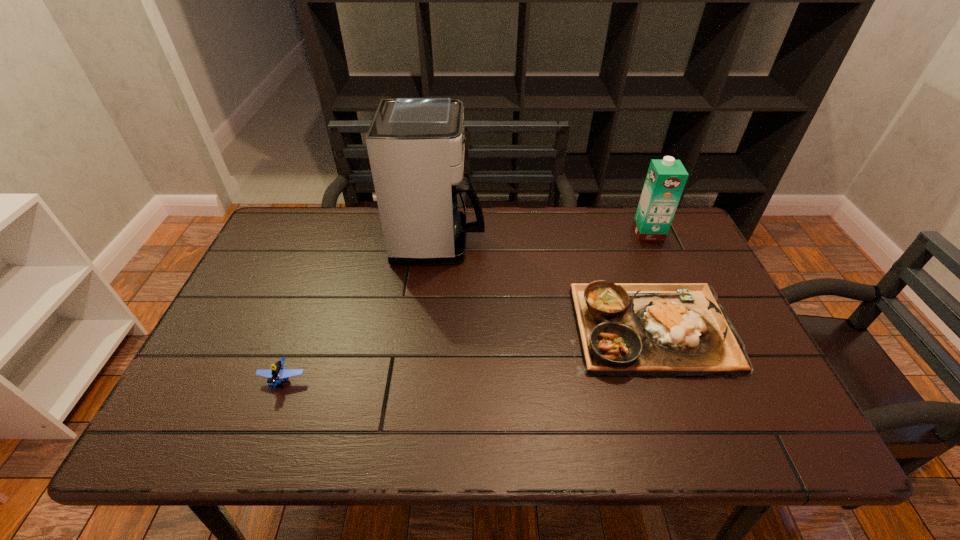
Image resolution: width=960 pixels, height=540 pixels. Identify the location of empty location between the platter and the second tallest object. (649, 280).

You are a GUI agent. You are given a task and a screenshot of the screen. Output one action in this format:
    pyautogui.click(x=<x>, y=<y>)
    Task: Click on the free spot between the shortest object and the coffee maker
    
    Given the screenshot: What is the action you would take?
    pyautogui.click(x=361, y=311)

This screenshot has width=960, height=540. I want to click on free space between the shortest object and the platter, so click(467, 354).

You are a GUI agent. You are given a task and a screenshot of the screen. Output one action in this format:
    pyautogui.click(x=<x>, y=<y>)
    Task: Click on the free point between the shortest object and the third tallest object
    The height and width of the screenshot is (540, 960).
    Given the screenshot: What is the action you would take?
    pyautogui.click(x=467, y=354)

The width and height of the screenshot is (960, 540). What are the coordinates of `free point between the carton and the platter` in the screenshot? It's located at (649, 280).

Locate an element on the screen. The height and width of the screenshot is (540, 960). free area in between the third object from right to left and the carton is located at coordinates (544, 237).

The image size is (960, 540). I want to click on vacant space that is in between the coffee maker and the carton, so click(544, 237).

The width and height of the screenshot is (960, 540). In order to click on empty location between the coffee maker and the Lego in this screenshot , I will do `click(361, 311)`.

Locate an element on the screen. free space between the tallest object and the leftmost object is located at coordinates (361, 311).

Identify the location of object that is the third closest one to the Lego. The height and width of the screenshot is (540, 960). click(x=665, y=181).